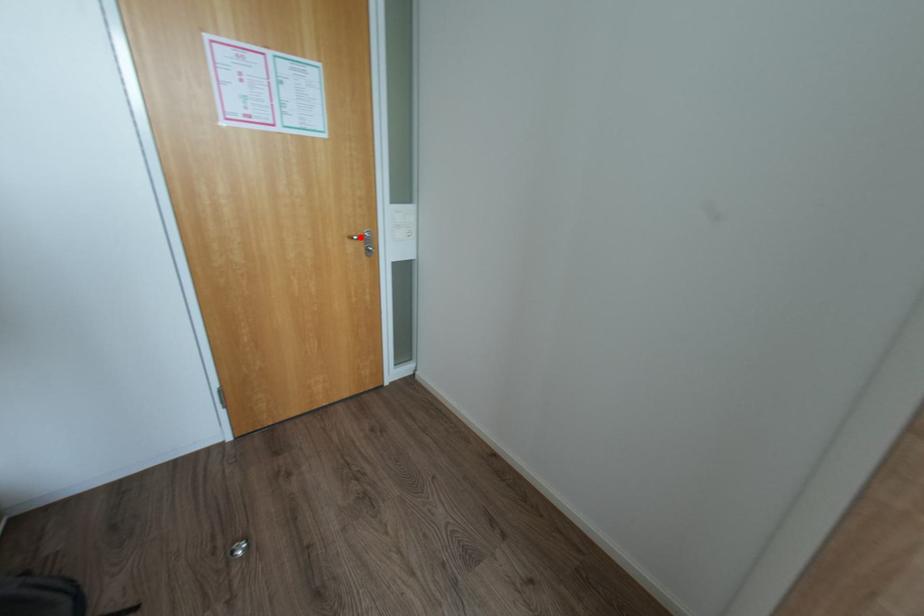
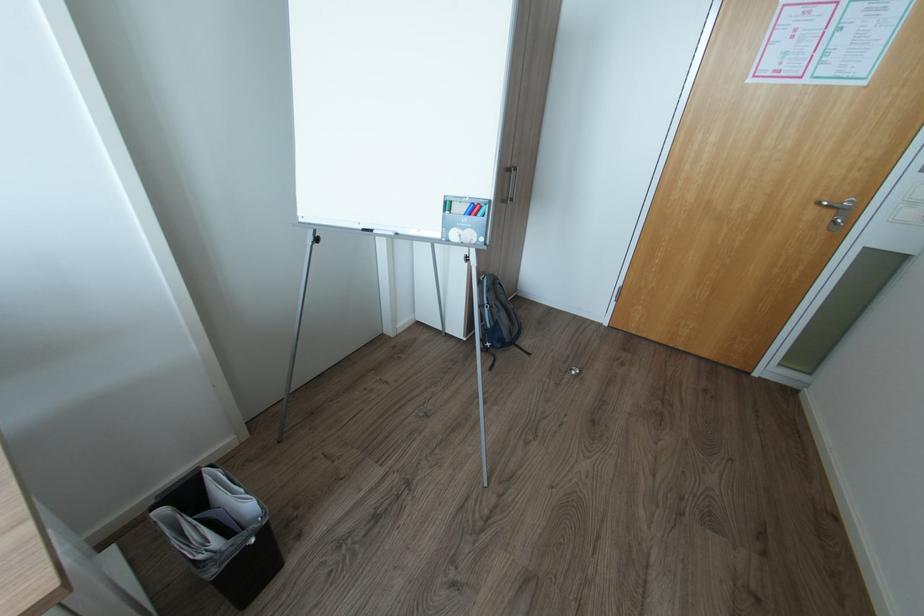
The point at the highlighted location is marked in the first image. Where is the corresponding point in the second image?

(830, 204)